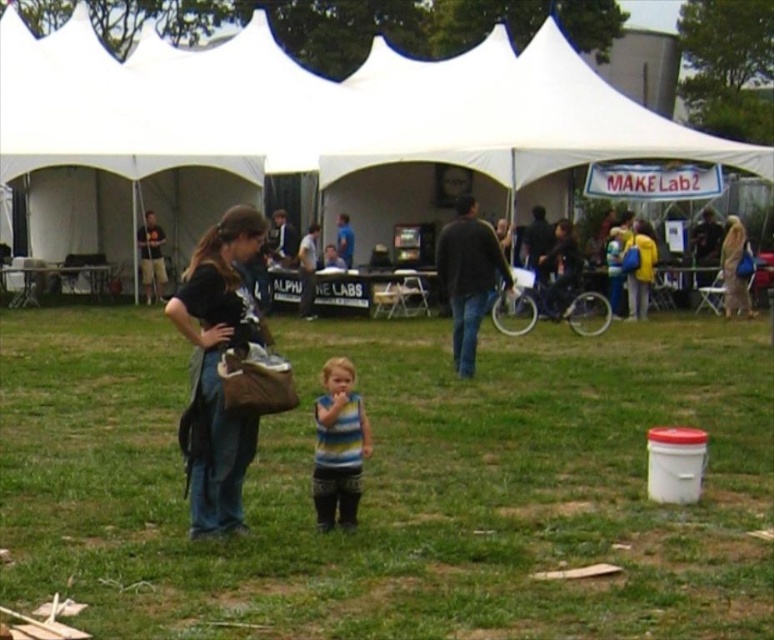
You are planning to set up a small picnic blanket in the area where the green grass at center and white fabric tent at center are located. Considering their sizes, which object would you need to move or adjust to make space for the picnic blanket?

The green grass at center is thinner than the white fabric tent at center, so you would need to move or adjust the white fabric tent at center to make space for the picnic blanket since it occupies more area.

Based on the scene description, which object is bigger between the white fabric tent at center and the matte black shirt at center?

The white fabric tent at center is larger in size than the matte black shirt at center.

You are at the outdoor event and need to place a small plant pot on the ground. The plant pot must be placed where the green grass at center and the light beige fabric bag at right are visible. Where should you put it?

Place the plant pot on the green grass at center, as it is located below the light beige fabric bag at right, ensuring both are visible from the pot.